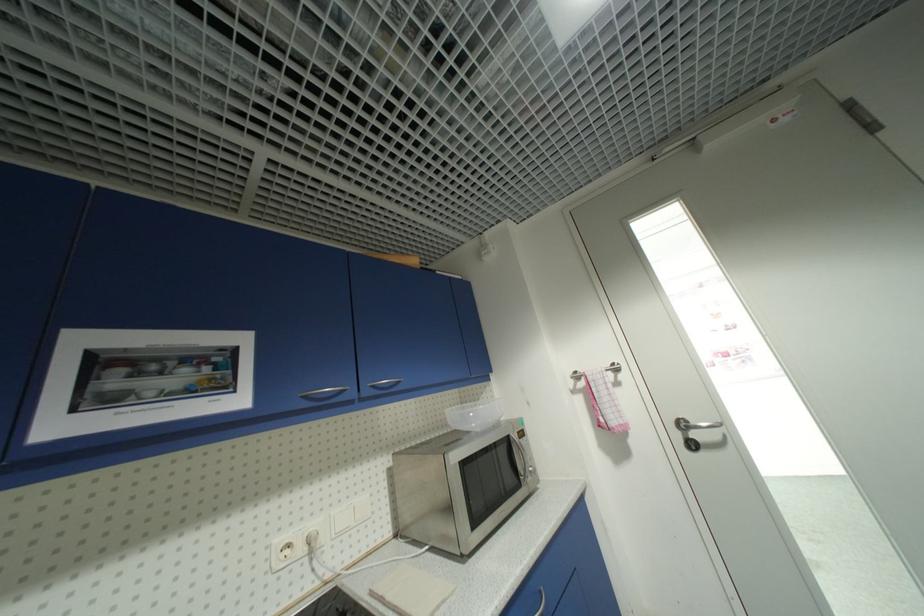
Find where to hang the silver towel rack. Please return your answer as a coordinate pair (x, y).

(598, 371)